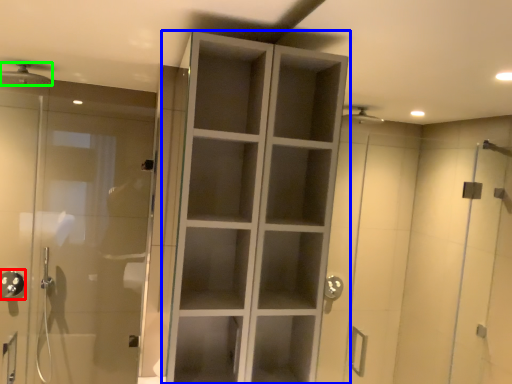
Question: Which object is positioned closest to shower (highlighted by a red box)? Select from cupboard (highlighted by a blue box) and shower (highlighted by a green box).

Choices:
 (A) cupboard
 (B) shower

Answer: (B)